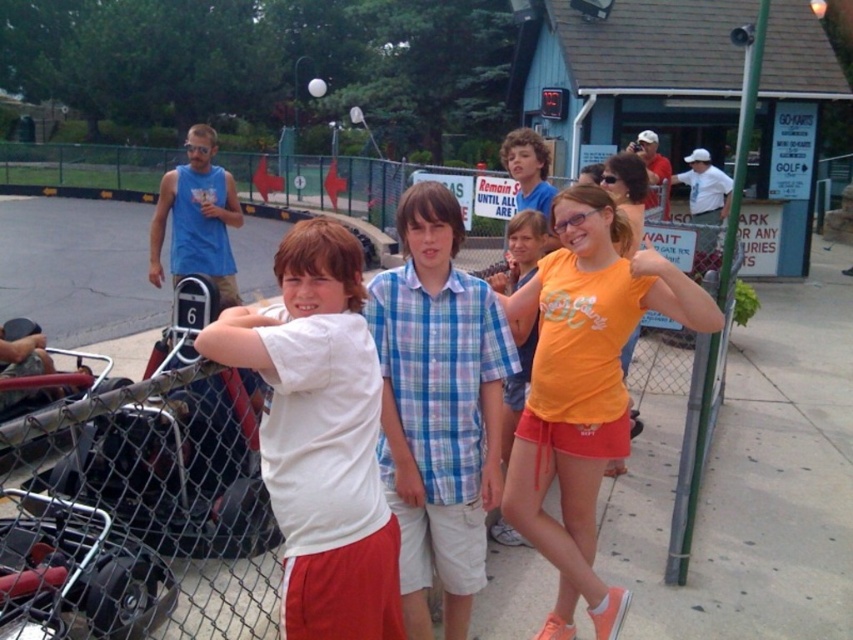
Question: Is blue plaid shirt at center in front of orange cotton shorts at center?

Choices:
 (A) yes
 (B) no

Answer: (A)

Question: Which point appears closest to the camera in this image?

Choices:
 (A) (459, 378)
 (B) (345, 410)
 (C) (506, 545)
 (D) (535, 433)

Answer: (B)

Question: Does white matte shirt at center have a larger size compared to blue plaid shirt at center?

Choices:
 (A) no
 (B) yes

Answer: (A)

Question: Which point is closer to the camera?

Choices:
 (A) white matte shirt at center
 (B) blue plaid shirt at center
 (C) orange matte t-shirt at center

Answer: (A)

Question: Does blue plaid shirt at center have a smaller size compared to orange cotton shorts at center?

Choices:
 (A) yes
 (B) no

Answer: (B)

Question: Which point appears farthest from the camera in this image?

Choices:
 (A) (387, 458)
 (B) (683, 285)

Answer: (A)